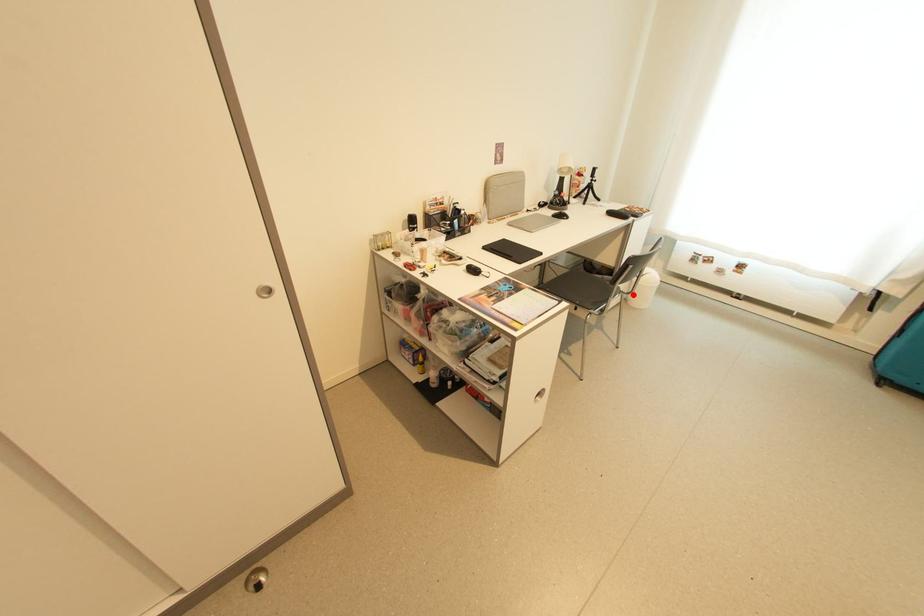
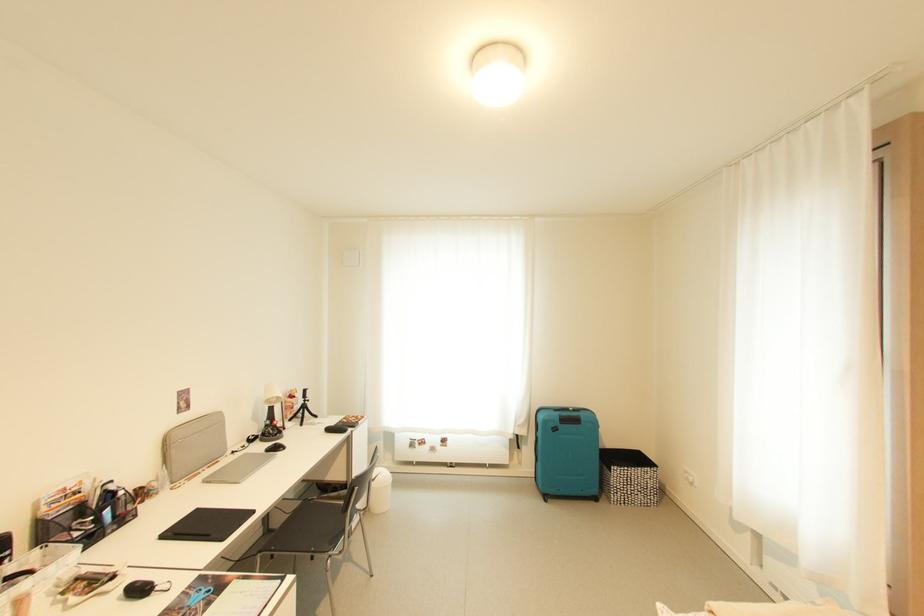
Locate, in the second image, the point that corresponds to the highlighted location in the first image.

(370, 511)